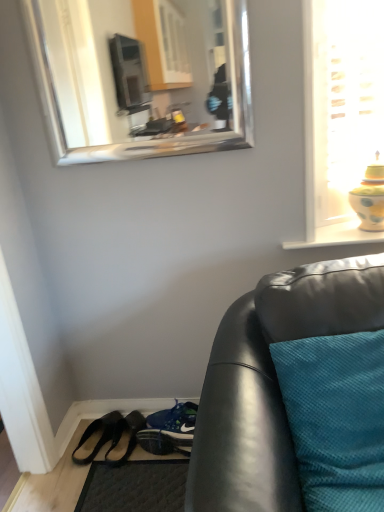
Question: Based on their sizes in the image, would you say black leather shoes at lower left, positioned as the second footwear in left-to-right order, is bigger or smaller than dark gray textured mat at lower left?

Choices:
 (A) big
 (B) small

Answer: (B)

Question: Is black leather shoes at lower left, positioned as the second footwear in left-to-right order, to the left or to the right of dark gray textured mat at lower left in the image?

Choices:
 (A) left
 (B) right

Answer: (A)

Question: Based on their relative distances, which object is nearer to the blue fabric shoe at lower center, which appears as the 2th shoe when viewed from the front?

Choices:
 (A) teal fabric cushion at lower right
 (B) silver/metallic mirror at upper center
 (C) dark gray textured mat at lower left
 (D) black leather shoes at lower left, which appears as the first footwear when viewed from the right
 (E) black leather shoes at lower left, which ranks as the second footwear in right-to-left order

Answer: (D)

Question: Which is nearer to the silver/metallic mirror at upper center?

Choices:
 (A) black leather shoes at lower left, which is counted as the 1th footwear, starting from the left
 (B) blue fabric shoe at lower center, the 1th shoe positioned from the back
 (C) black leather shoes at lower left, positioned as the second footwear in left-to-right order
 (D) teal fabric cushion at lower right
 (E) dark gray textured mat at lower left

Answer: (D)